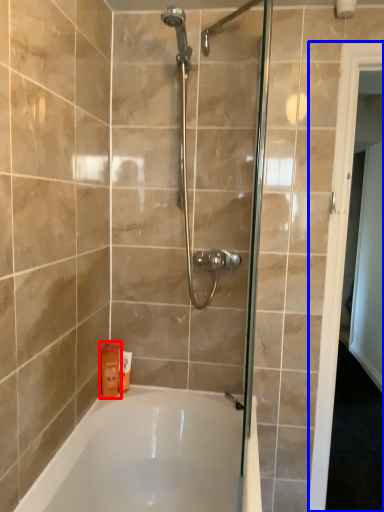
Question: Which point is closer to the camera, toiletry (highlighted by a red box) or screen door (highlighted by a blue box)?

Choices:
 (A) toiletry
 (B) screen door

Answer: (B)